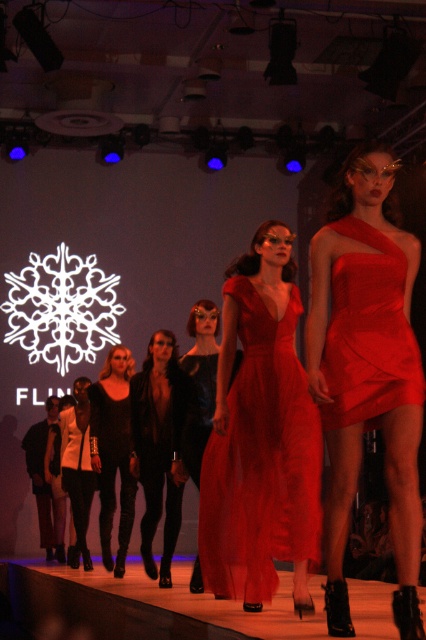
You are a photographer at the fashion show and need to position your camera to capture the black leather jacket at center. According to the coordinates provided, where should you aim your camera to ensure the jacket is centered in the frame?

The black leather jacket at center is located at the 2D coordinates point (158,445), so you should aim your camera at that point to center the jacket in the frame.

You are a photographer at the runway show and need to capture a clear shot of both the black leather jacket at center and the satin black dress at center. Given that the camera can only focus on one object at a time, which object should you focus on first to ensure it appears sharp in the photo?

The black leather jacket at center is below the satin black dress at center, so you should focus on the satin black dress at center first since it is higher up and likely in the primary focal plane.